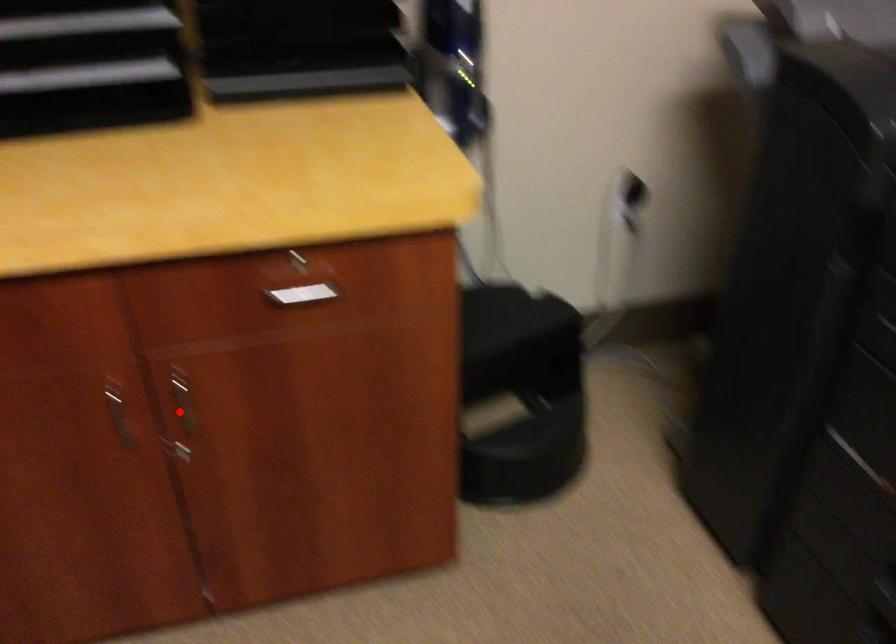
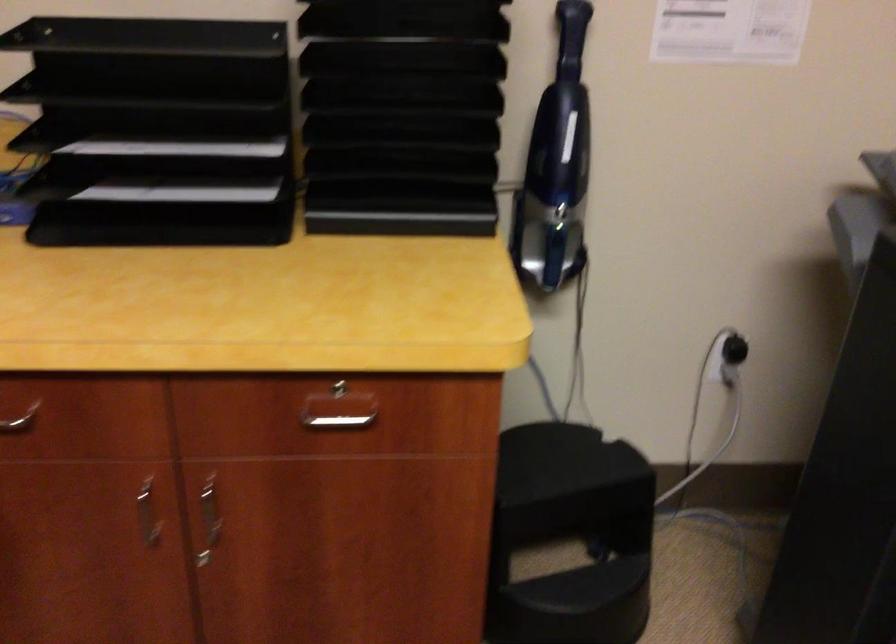
Find the pixel in the second image that matches the highlighted location in the first image.

(209, 520)